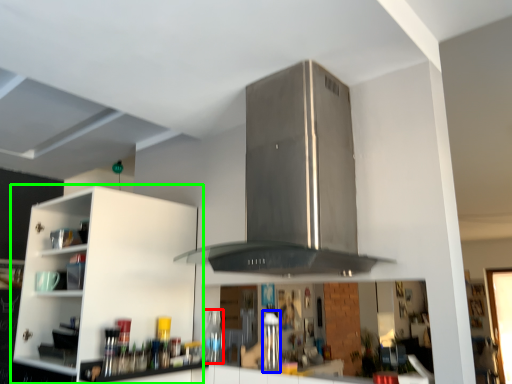
Question: Estimate the real-world distances between objects in this image. Which object is farther from bottle (highlighted by a red box), appliance (highlighted by a blue box) or cabinetry (highlighted by a green box)?

Choices:
 (A) appliance
 (B) cabinetry

Answer: (B)